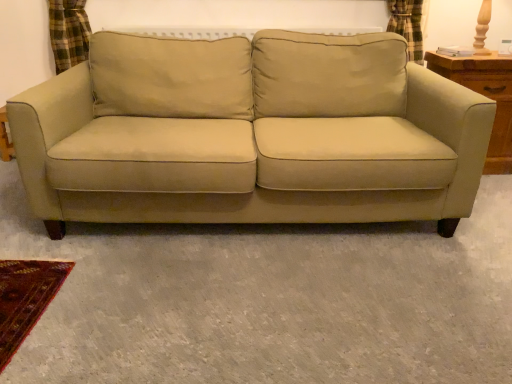
Question: Does point (487, 168) appear closer or farther from the camera than point (339, 135)?

Choices:
 (A) closer
 (B) farther

Answer: (B)

Question: From the image's perspective, is wooden dresser at right above or below suede-like beige couch at center?

Choices:
 (A) below
 (B) above

Answer: (B)

Question: Would you say wooden dresser at right is inside or outside suede-like beige couch at center?

Choices:
 (A) outside
 (B) inside

Answer: (A)

Question: Considering the positions of suede-like beige couch at center and wooden dresser at right in the image, is suede-like beige couch at center wider or thinner than wooden dresser at right?

Choices:
 (A) thin
 (B) wide

Answer: (B)

Question: Does point pos(31,196) appear closer or farther from the camera than point pos(496,52)?

Choices:
 (A) farther
 (B) closer

Answer: (B)

Question: Is suede-like beige couch at center inside or outside of wooden dresser at right?

Choices:
 (A) inside
 (B) outside

Answer: (B)

Question: From the image's perspective, relative to wooden dresser at right, is suede-like beige couch at center above or below?

Choices:
 (A) above
 (B) below

Answer: (B)